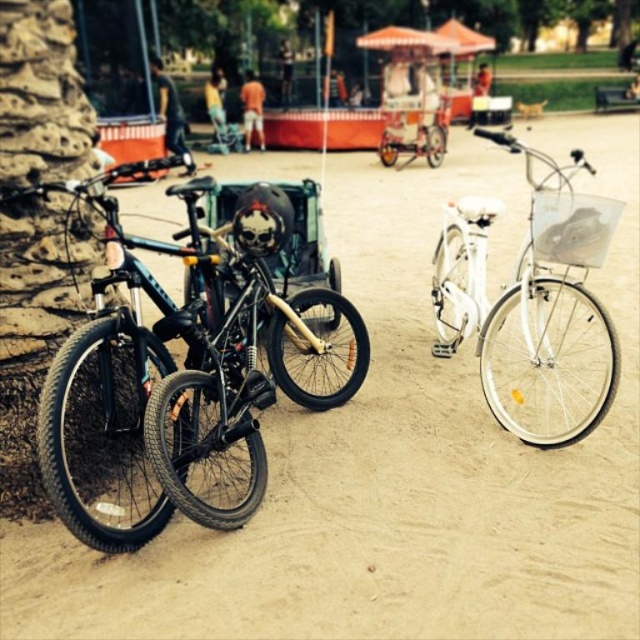
Question: Is shiny black bicycle at left behind white metallic bicycle at right?

Choices:
 (A) yes
 (B) no

Answer: (B)

Question: Which of the following is the farthest from the observer?

Choices:
 (A) white metallic bicycle at right
 (B) shiny black bicycle at left

Answer: (A)

Question: Which object is farther from the camera taking this photo?

Choices:
 (A) shiny black bicycle at left
 (B) white metallic bicycle at right

Answer: (B)

Question: Does shiny black bicycle at left appear on the right side of white metallic bicycle at right?

Choices:
 (A) no
 (B) yes

Answer: (A)

Question: Which point is closer to the camera?

Choices:
 (A) (605, 252)
 (B) (45, 426)

Answer: (B)

Question: Is shiny black bicycle at left above white metallic bicycle at right?

Choices:
 (A) yes
 (B) no

Answer: (B)